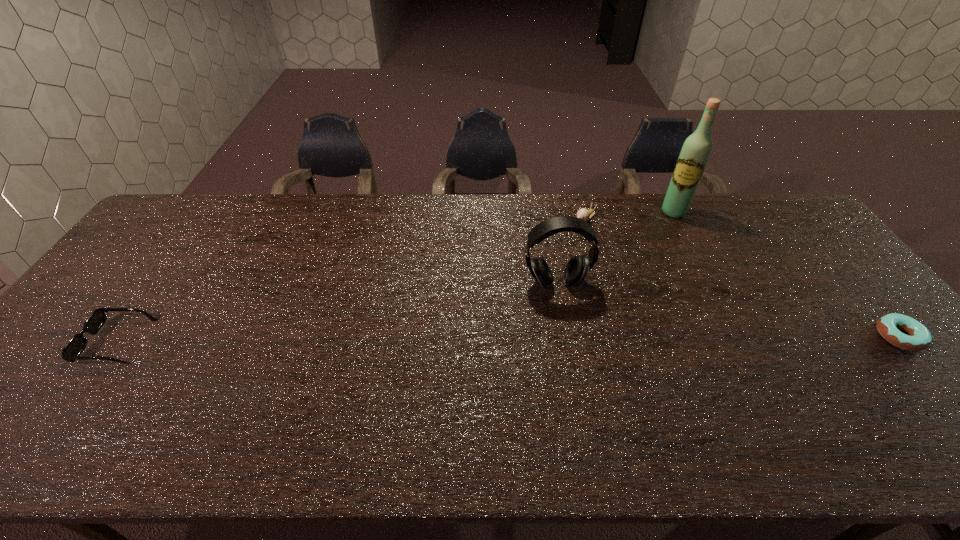
Locate an element on the screen. This screenshot has width=960, height=540. free spot between the sunglasses and the tallest object is located at coordinates (396, 276).

Locate which object is the fourth closest to the shortest object. Please provide its 2D coordinates. Your answer should be formatted as a tuple, i.e. [(x, y)], where the tuple contains the x and y coordinates of a point satisfying the conditions above.

[(71, 352)]

Identify the location of object that is the closest to the sunglasses. The height and width of the screenshot is (540, 960). (577, 268).

The height and width of the screenshot is (540, 960). Find the location of `free spot that satisfies the following two spatial constraints: 1. on the front side of the escargot; 2. on the right side of the doughnut`. free spot that satisfies the following two spatial constraints: 1. on the front side of the escargot; 2. on the right side of the doughnut is located at coordinates (616, 336).